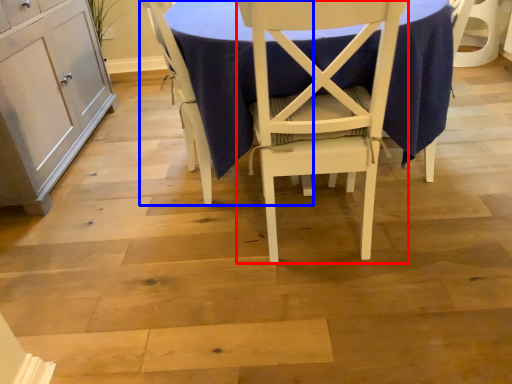
Question: Which object is further to the camera taking this photo, chair (highlighted by a red box) or chair (highlighted by a blue box)?

Choices:
 (A) chair
 (B) chair

Answer: (B)